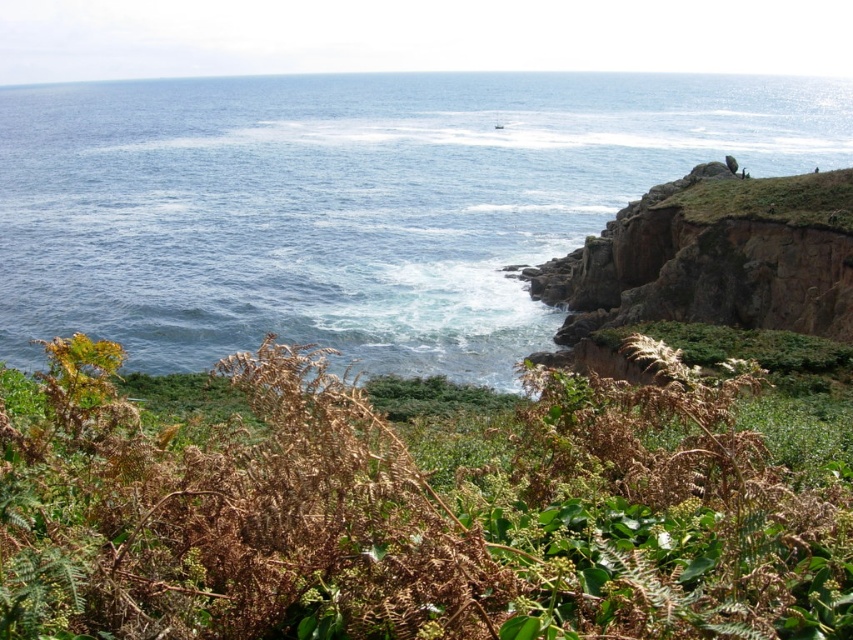
Question: Can you confirm if brown dried leaves at lower center is thinner than blue water at center?

Choices:
 (A) yes
 (B) no

Answer: (A)

Question: Which point is closer to the camera taking this photo?

Choices:
 (A) (784, 196)
 (B) (315, 529)

Answer: (B)

Question: Among these objects, which one is farthest from the camera?

Choices:
 (A) brown dried leaves at lower center
 (B) brown rocky cliff at upper right
 (C) blue water at center

Answer: (C)

Question: Can you confirm if brown dried leaves at lower center is positioned above blue water at center?

Choices:
 (A) no
 (B) yes

Answer: (A)

Question: Can you confirm if blue water at center is wider than brown rocky cliff at upper right?

Choices:
 (A) yes
 (B) no

Answer: (A)

Question: Which point appears farthest from the camera in this image?

Choices:
 (A) (80, 284)
 (B) (392, 540)
 (C) (824, 200)

Answer: (A)